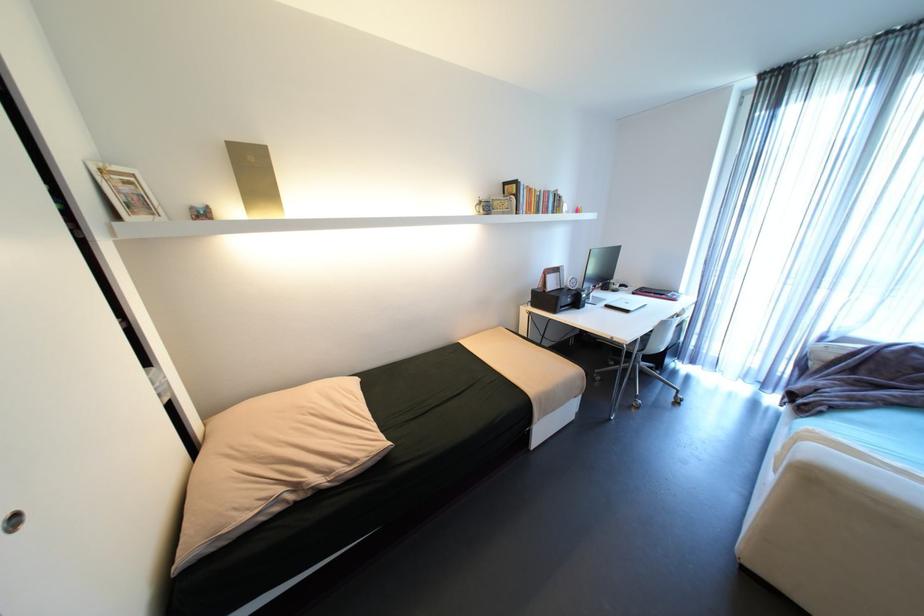
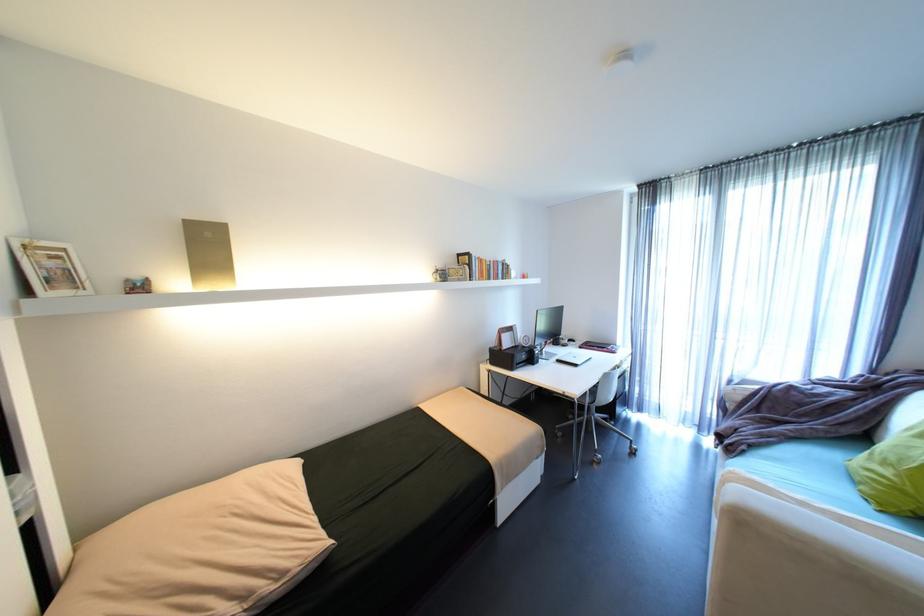
The point at (642, 341) is marked in the first image. Where is the corresponding point in the second image?

(592, 394)